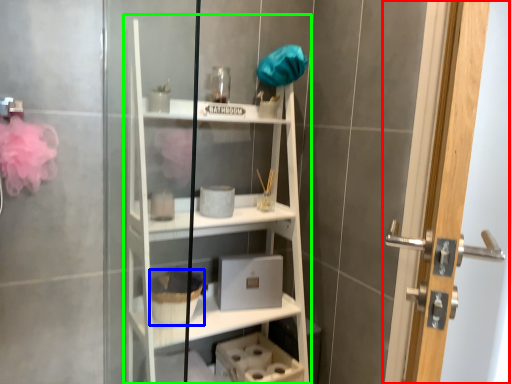
Question: Which object is the closest to the door (highlighted by a red box)? Choose among these: basket (highlighted by a blue box) or bookshelf (highlighted by a green box).

Choices:
 (A) basket
 (B) bookshelf

Answer: (B)